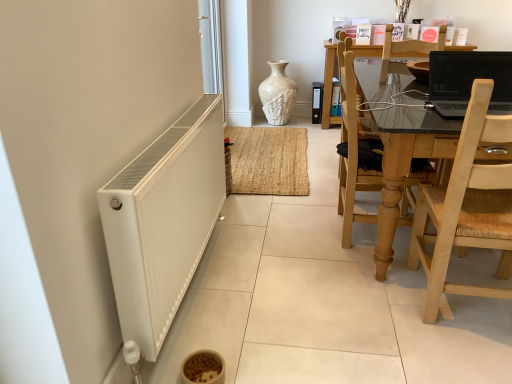
The width and height of the screenshot is (512, 384). In order to click on free space underneath white matte radiator at lower left (from a real-world perspective) in this screenshot , I will do `click(195, 289)`.